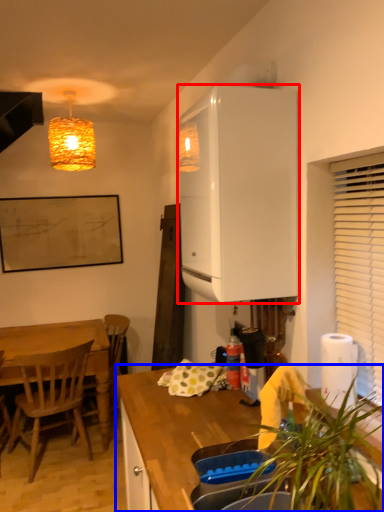
Question: Among these objects, which one is nearest to the camera, cabinetry (highlighted by a red box) or countertop (highlighted by a blue box)?

Choices:
 (A) cabinetry
 (B) countertop

Answer: (B)